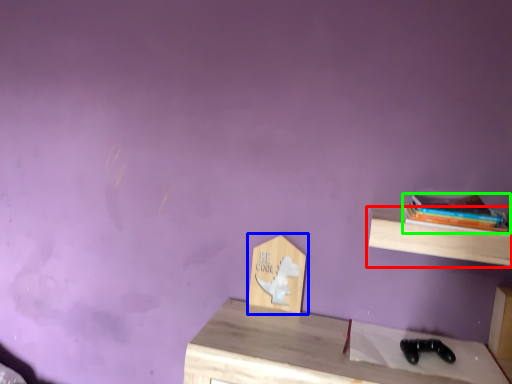
Question: Considering the real-world distances, which object is farthest from shelf (highlighted by a red box)? shelf (highlighted by a blue box) or book (highlighted by a green box)?

Choices:
 (A) shelf
 (B) book

Answer: (A)